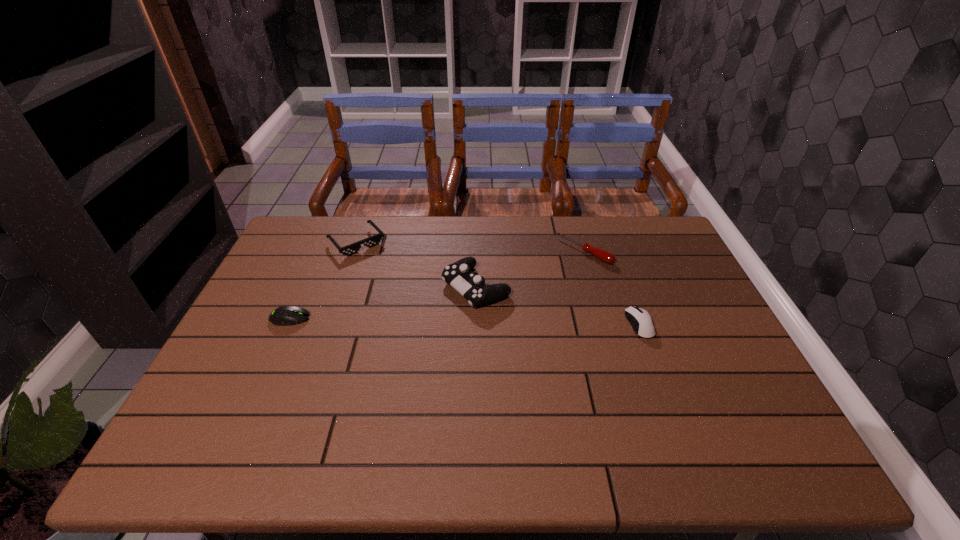
Identify the location of empty space that is in between the screwdriver and the right mouse. The image size is (960, 540). (612, 288).

You are a GUI agent. You are given a task and a screenshot of the screen. Output one action in this format:
    pyautogui.click(x=<x>, y=<y>)
    Task: Click on the vacant area that lies between the screwdriver and the right mouse
    The height and width of the screenshot is (540, 960).
    Given the screenshot: What is the action you would take?
    pyautogui.click(x=612, y=288)

Find the location of a particular element. Image resolution: width=960 pixels, height=540 pixels. empty space between the third object from left to right and the sunglasses is located at coordinates (416, 265).

Image resolution: width=960 pixels, height=540 pixels. What are the coordinates of `vacant space that is in between the third object from right to left and the screwdriver` in the screenshot? It's located at (530, 269).

Locate an element on the screen. The image size is (960, 540). free space between the tallest object and the sunglasses is located at coordinates (416, 265).

At what (x,y) coordinates should I click in order to perform the action: click on vacant area that lies between the shorter mouse and the sunglasses. Please return your answer as a coordinate pair (x, y). The width and height of the screenshot is (960, 540). Looking at the image, I should click on click(324, 280).

Choose which object is the second nearest neighbor to the sunglasses. Please provide its 2D coordinates. Your answer should be formatted as a tuple, i.e. [(x, y)], where the tuple contains the x and y coordinates of a point satisfying the conditions above.

[(287, 315)]

Identify which object is the fourth closest to the right mouse. Please provide its 2D coordinates. Your answer should be formatted as a tuple, i.e. [(x, y)], where the tuple contains the x and y coordinates of a point satisfying the conditions above.

[(287, 315)]

You are a GUI agent. You are given a task and a screenshot of the screen. Output one action in this format:
    pyautogui.click(x=<x>, y=<y>)
    Task: Click on the free space that satisfies the following two spatial constraints: 1. on the front side of the right mouse; 2. on the right side of the tallest object
    
    Given the screenshot: What is the action you would take?
    pyautogui.click(x=475, y=325)

Locate an element on the screen. This screenshot has height=540, width=960. free spot that satisfies the following two spatial constraints: 1. on the front side of the tallest object; 2. on the right side of the right mouse is located at coordinates (475, 325).